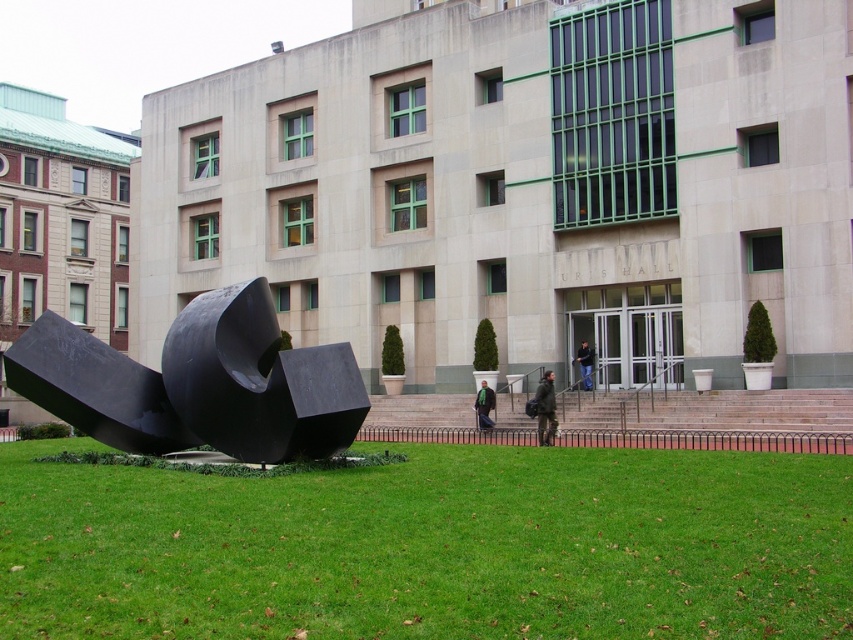
From the picture: You are standing at the entrance of URIS HALL and want to place a small potted plant exactly at the point labeled as point (x=431, y=547). Based on the scene description, what surface will the potted plant be placed on?

The point (x=431, y=547) is on green grass at lower center, so the potted plant will be placed on the green grass at lower center.

You are standing at the entrance of URIS HALL and see the green grass at lower center and the dark gray fabric jacket at center. Which object is closer to you?

The green grass at lower center is closer to you because it is in front of the dark gray fabric jacket at center.